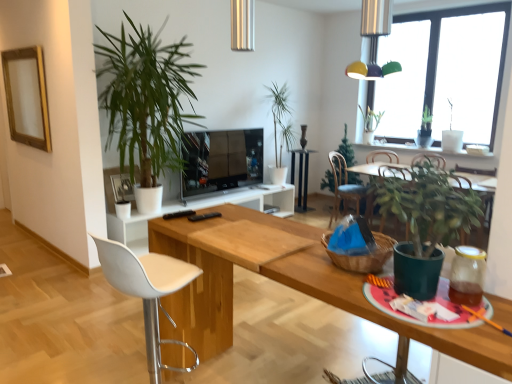
This screenshot has height=384, width=512. I want to click on free area behind wooden table at center, so click(x=302, y=340).